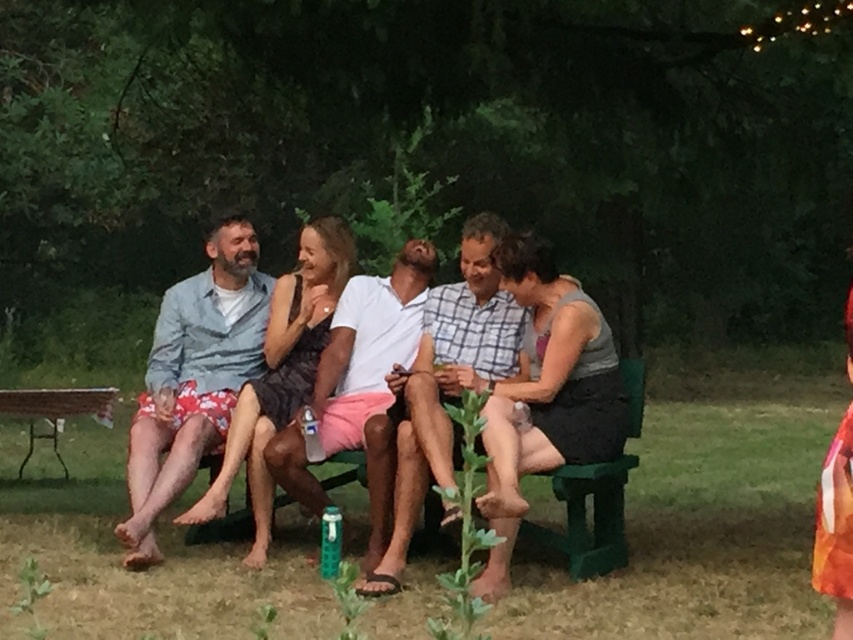
Question: Considering the relative positions of matte white shirt at center and white matte shirt at center in the image provided, where is matte white shirt at center located with respect to white matte shirt at center?

Choices:
 (A) left
 (B) right

Answer: (B)

Question: Which point is closer to the camera?

Choices:
 (A) (233, 353)
 (B) (479, 310)
 (C) (57, 452)

Answer: (B)

Question: Among these objects, which one is farthest from the camera?

Choices:
 (A) white cotton shirt at center
 (B) white matte shirt at center
 (C) light blue denim shirt at left
 (D) green plastic picnic table at lower left

Answer: (D)

Question: Among these objects, which one is farthest from the camera?

Choices:
 (A) green plastic picnic table at lower left
 (B) matte white shirt at center
 (C) white matte shirt at center

Answer: (A)

Question: Does white matte shirt at center appear over white cotton shirt at center?

Choices:
 (A) yes
 (B) no

Answer: (B)

Question: Does white matte shirt at center have a smaller size compared to white cotton shirt at center?

Choices:
 (A) yes
 (B) no

Answer: (B)